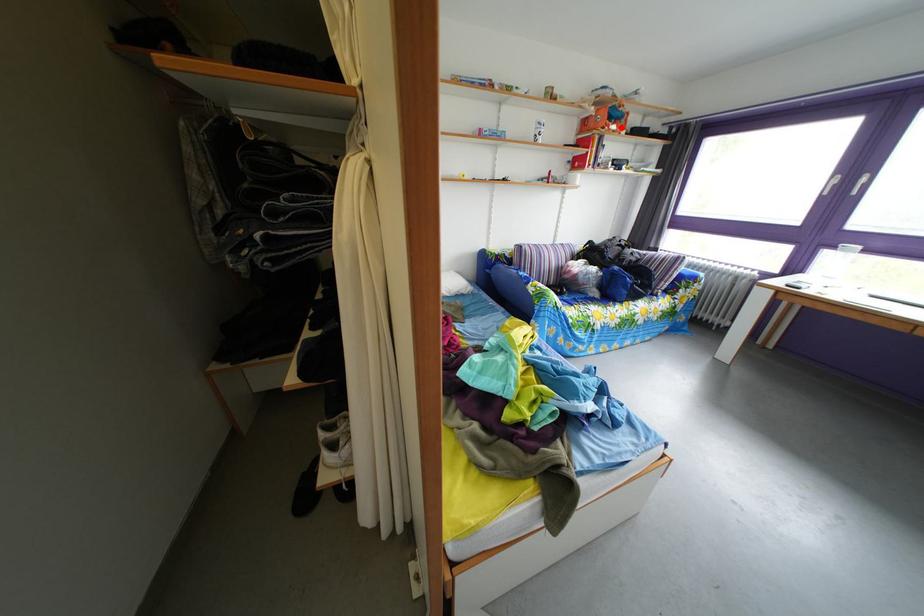
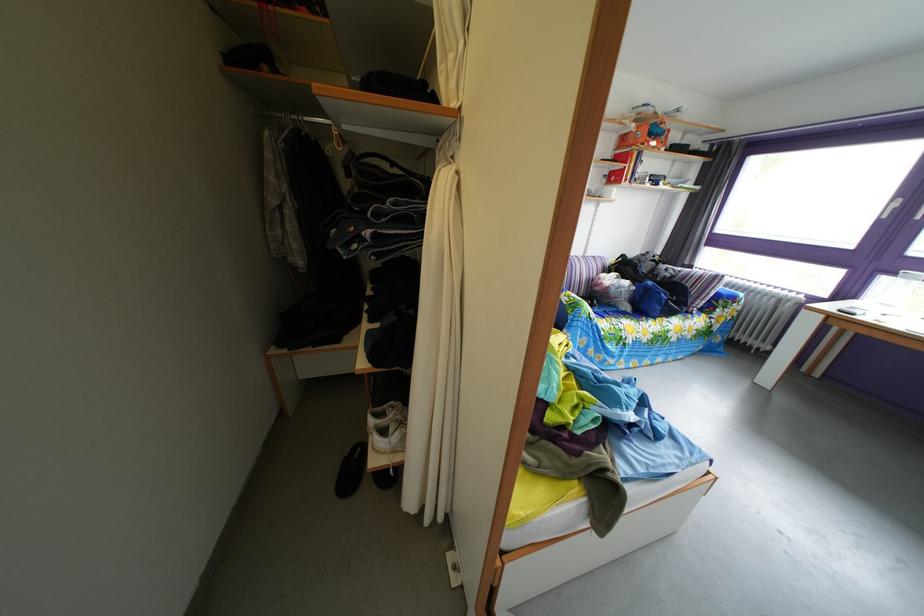
Find the pixel in the second image that matches the highlighted location in the first image.

(661, 144)